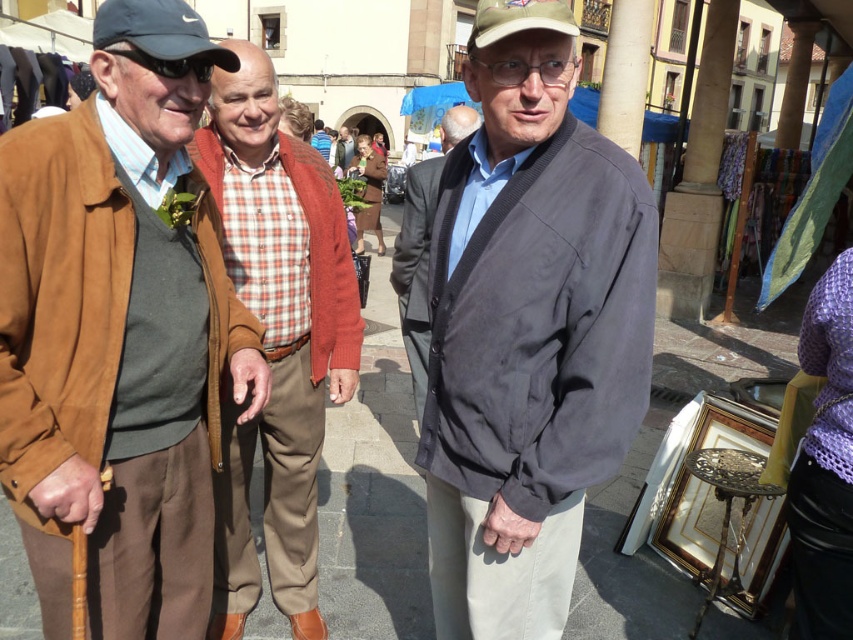
At what (x,y) coordinates should I click in order to perform the action: click on dark gray suede jacket at center. Please return your answer as a coordinate pair (x, y). Looking at the image, I should click on (527, 330).

Is point (471, 552) less distant than point (468, 129)?

That is True.

Describe the element at coordinates (527, 330) in the screenshot. I see `dark gray suede jacket at center` at that location.

I want to click on dark gray suede jacket at center, so click(x=527, y=330).

Does brown suede jacket at left appear on the left side of dark gray suit at center?

Yes, brown suede jacket at left is to the left of dark gray suit at center.

At what (x,y) coordinates should I click in order to perform the action: click on brown suede jacket at left. Please return your answer as a coordinate pair (x, y). The width and height of the screenshot is (853, 640). Looking at the image, I should click on (120, 332).

Locate an element on the screen. This screenshot has height=640, width=853. brown suede jacket at left is located at coordinates (120, 332).

Who is more forward, (x=64, y=522) or (x=627, y=196)?

Point (x=627, y=196) is more forward.

The width and height of the screenshot is (853, 640). I want to click on brown suede jacket at left, so click(120, 332).